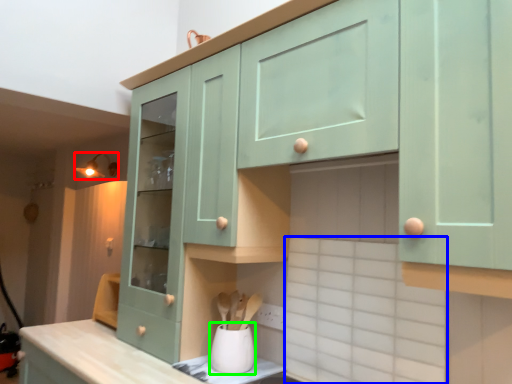
Question: Which object is positioned farthest from light fixture (highlighted by a red box)? Select from ceramic tile (highlighted by a blue box) and appliance (highlighted by a green box).

Choices:
 (A) ceramic tile
 (B) appliance

Answer: (A)